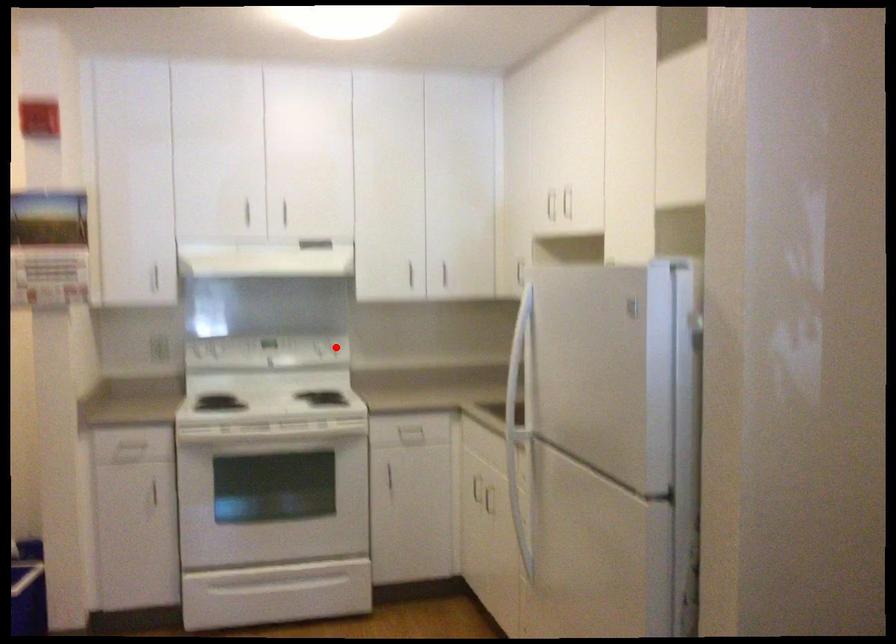
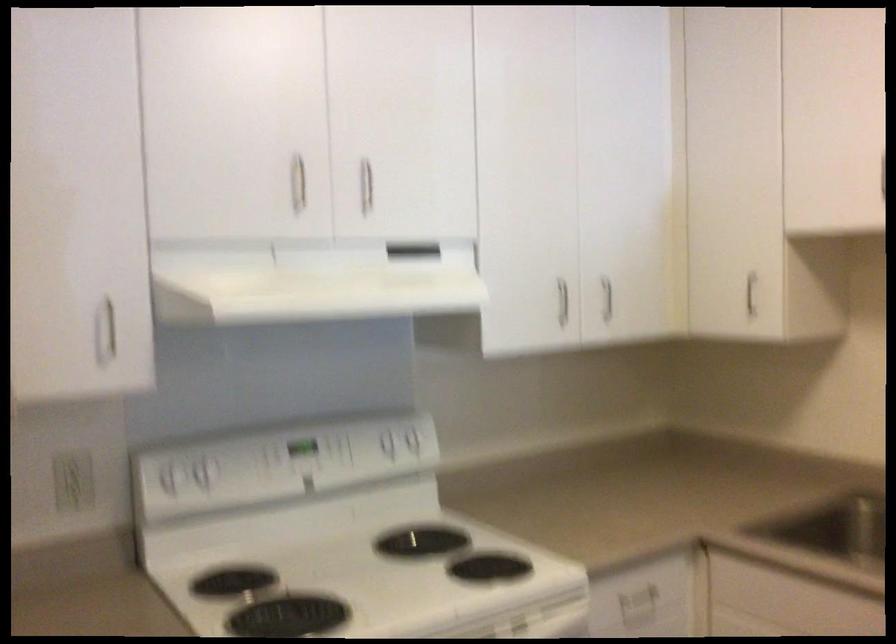
Where in the second image is the point corresponding to the highlighted location from the first image?

(419, 444)